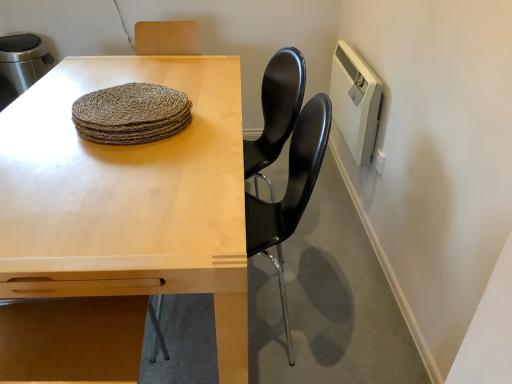
This screenshot has height=384, width=512. I want to click on free spot to the right of natural woven placemat at center, so click(216, 128).